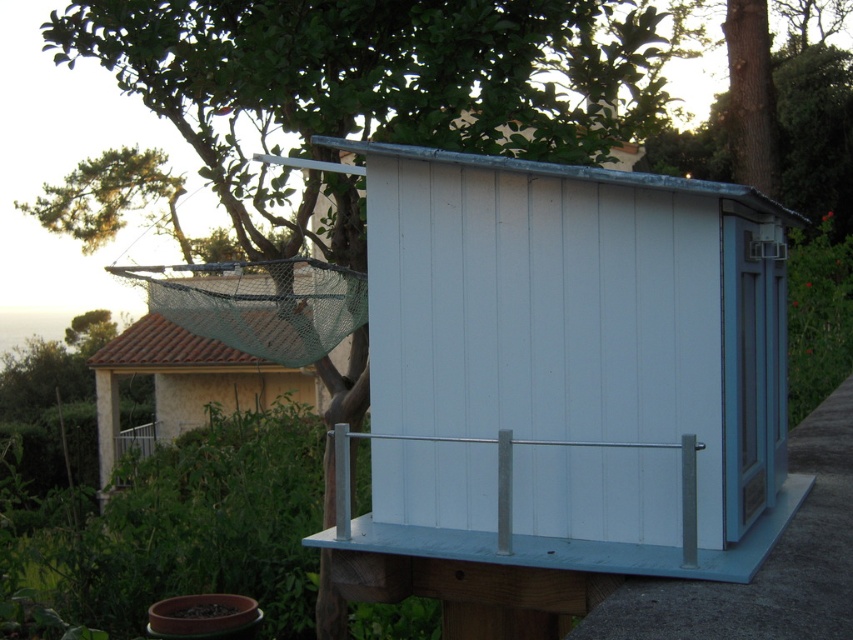
Does white wood shed at center come behind silver metallic rail at center?

No, it is in front of silver metallic rail at center.

Between point (646, 308) and point (556, 442), which one is positioned in front?

Point (556, 442) is in front.

Is point (497, 490) behind point (338, 529)?

No, it is in front of (338, 529).

This screenshot has height=640, width=853. Identify the location of white wood shed at center. (561, 385).

Is point (239, 381) closer to viewer compared to point (689, 515)?

No, it is not.

Does point (212, 340) come farther from viewer compared to point (550, 444)?

That is True.

Which is behind, point (96, 358) or point (506, 442)?

The point (96, 358) is behind.

You are a GUI agent. You are given a task and a screenshot of the screen. Output one action in this format:
    pyautogui.click(x=<x>, y=<y>)
    Task: Click on the green mesh net at upper left
    The height and width of the screenshot is (640, 853).
    Given the screenshot: What is the action you would take?
    pyautogui.click(x=183, y=381)

Which of these two, white wood shed at center or green mesh net at upper left, stands shorter?

green mesh net at upper left is shorter.

Does point (573, 289) come closer to viewer compared to point (270, 388)?

Yes, point (573, 289) is closer to viewer.

The height and width of the screenshot is (640, 853). Find the location of `white wood shed at center`. white wood shed at center is located at coordinates (561, 385).